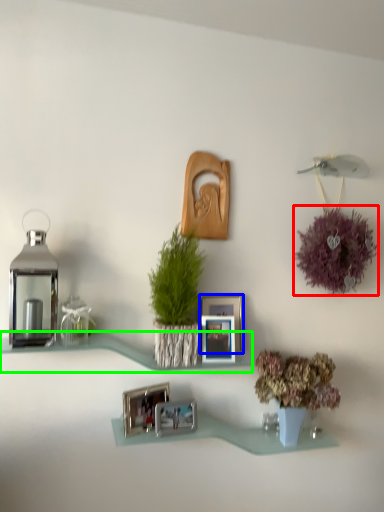
Question: Estimate the real-world distances between objects in this image. Which object is closer to flower (highlighted by a red box), picture frame (highlighted by a blue box) or shelf (highlighted by a green box)?

Choices:
 (A) picture frame
 (B) shelf

Answer: (A)